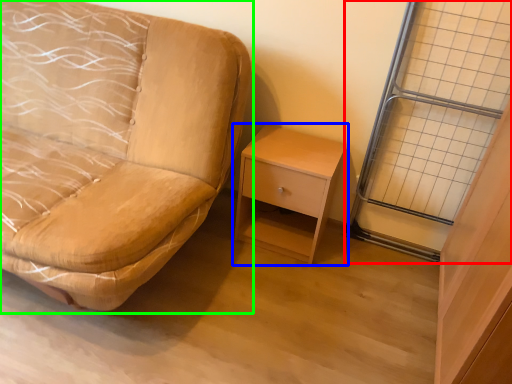
Question: Considering the real-world distances, which object is farthest from glass door (highlighted by a red box)? nightstand (highlighted by a blue box) or studio couch (highlighted by a green box)?

Choices:
 (A) nightstand
 (B) studio couch

Answer: (B)